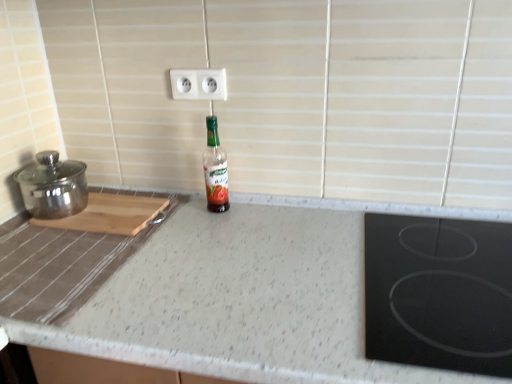
You are a GUI agent. You are given a task and a screenshot of the screen. Output one action in this format:
    pyautogui.click(x=<x>, y=<y>)
    Task: Click on the vacant area that lies between green glass bottle at center and wooden cutting board at left
    
    Given the screenshot: What is the action you would take?
    pyautogui.click(x=175, y=213)